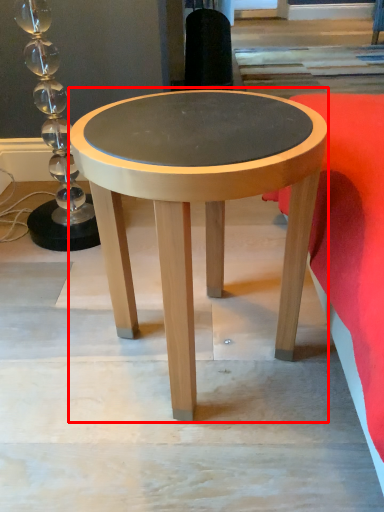
Question: From the image's perspective, where is coffee table (annotated by the red box) located relative to bedding?

Choices:
 (A) above
 (B) below

Answer: (B)